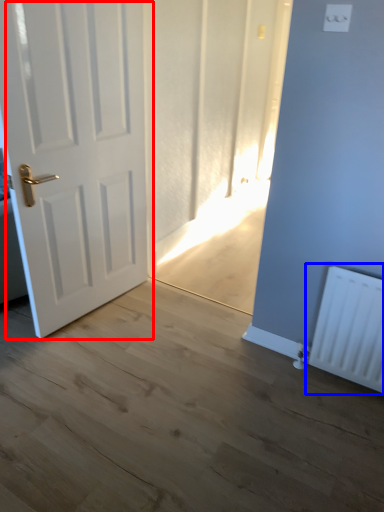
Question: Among these objects, which one is nearest to the camera, door (highlighted by a red box) or radiator (highlighted by a blue box)?

Choices:
 (A) door
 (B) radiator

Answer: (A)